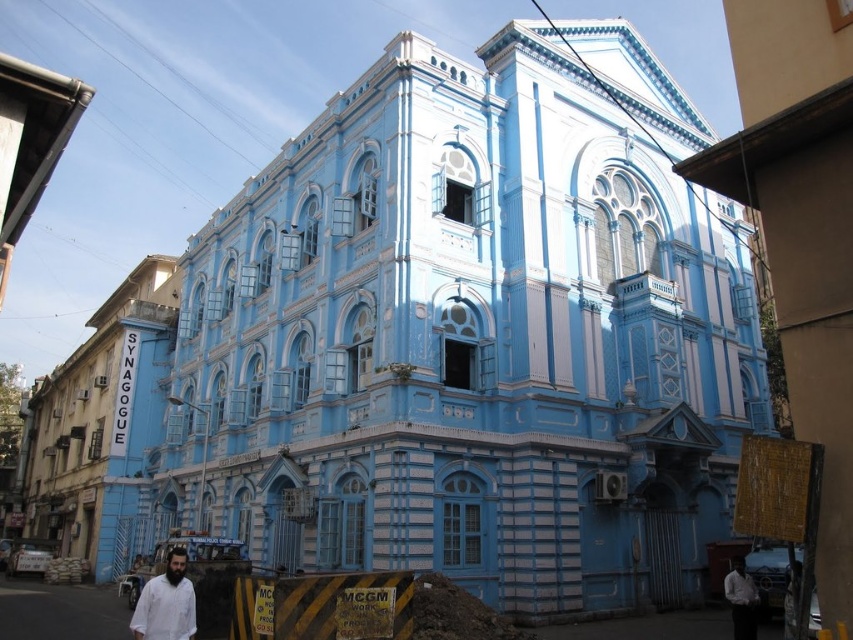
You are a photographer standing in front of the blue synagogue. You notice two white shirts hanging on a clothesline between the synagogue and a nearby building. Which shirt, the white matte shirt at lower left or the white shirt at lower right, is bigger in size?

The white matte shirt at lower left is larger in size than the white shirt at lower right.